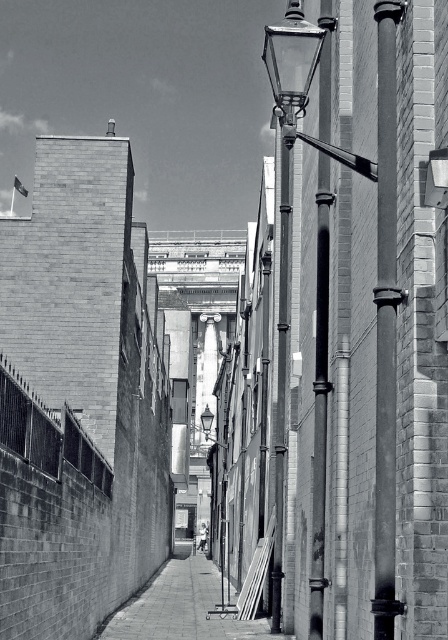
You are standing at the entrance of the alleyway and want to take a photo of the smooth metal pole at center right using a camera. The camera requires you to be at least 50 feet away to capture the entire pole in the frame. Based on the description, will you be able to capture the entire pole in your photo?

The smooth metal pole at center right and camera are 49.27 feet apart from each other, which is less than the required 50 feet. Therefore, you will not be able to capture the entire pole in your photo.

You are standing at the entrance of the alley and want to walk towards the flagpole on the left wall. Which object, the smooth concrete pavement at center or the smooth metal pole at center, will you encounter first?

The smooth concrete pavement at center is closer to the viewer than the smooth metal pole at center, so you will encounter the smooth concrete pavement at center first.

You are standing at the entrance of the alley and want to reach the smooth metal pole at center right. There is a wooden plank leaning against the building on the right. If the plank is 14 meters long, can you use it as a bridge to cross the alley to the pole?

The distance between you and the smooth metal pole at center right is 15.02 meters. Since the wooden plank is only 14 meters long, it is too short to span the entire distance. You cannot use it as a bridge to cross the alley to the smooth metal pole at center right.